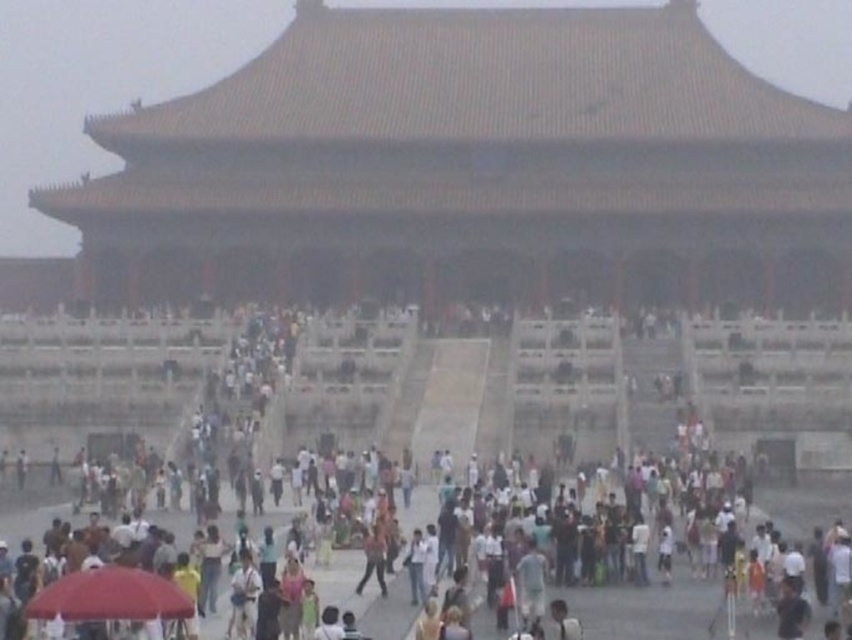
You are standing at the entrance of the palace and want to find the multicolored casual attire at center. According to the coordinates provided, where should you look relative to your current position?

The multicolored casual attire at center is located at coordinates point (298, 385), which means it is positioned 60.3 percent to the right and 35.1 percent up from the bottom left corner of the scene.

Consider the image. You are standing at the entrance of the traditional Chinese structure and want to take a photo of the crowd. You notice the multicolored casual attire at center and the red fabric umbrella at lower left. Which object is positioned to the right of the other?

The multicolored casual attire at center is to the right of the red fabric umbrella at lower left.